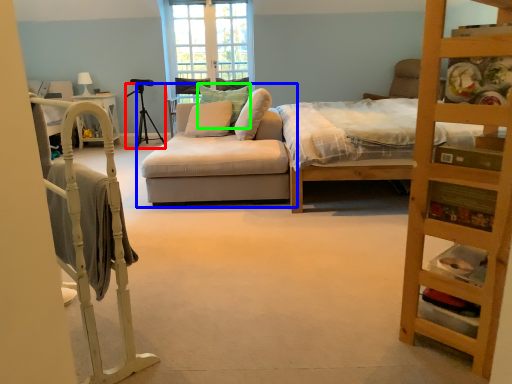
Question: Considering the real-world distances, which object is closest to tripod (highlighted by a red box)? studio couch (highlighted by a blue box) or pillow (highlighted by a green box).

Choices:
 (A) studio couch
 (B) pillow

Answer: (B)